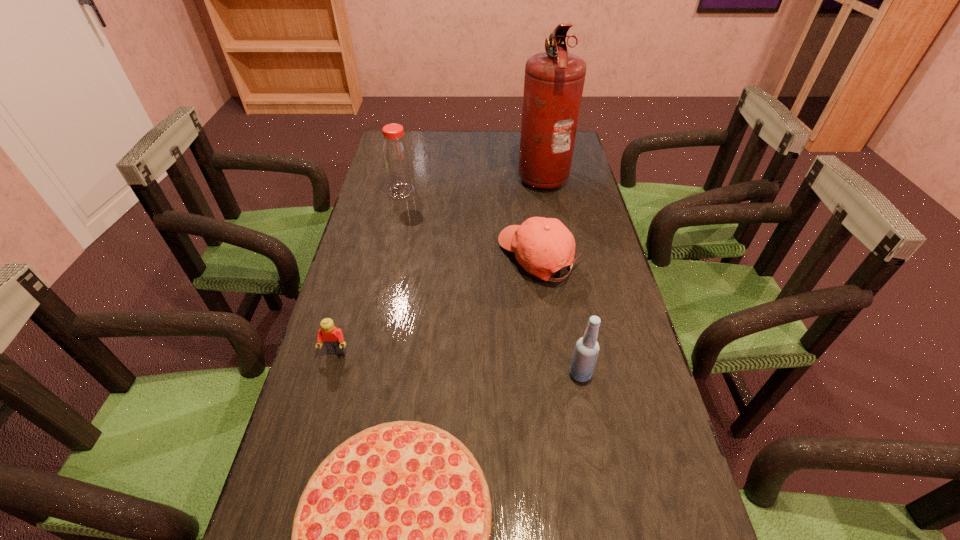
Locate an element on the screen. Image resolution: width=960 pixels, height=540 pixels. the tallest object is located at coordinates (554, 80).

I want to click on the farther bottle, so click(x=397, y=162).

Find the location of a particular element. the left bottle is located at coordinates (397, 162).

Identify the location of the third tallest object. This screenshot has width=960, height=540. (584, 358).

The height and width of the screenshot is (540, 960). In order to click on the nearer bottle in this screenshot , I will do `click(584, 358)`.

You are a GUI agent. You are given a task and a screenshot of the screen. Output one action in this format:
    pyautogui.click(x=<x>, y=<y>)
    Task: Click on the fourth nearest object
    This screenshot has width=960, height=540.
    Given the screenshot: What is the action you would take?
    pyautogui.click(x=542, y=246)

Locate an element on the screen. This screenshot has width=960, height=540. baseball cap is located at coordinates (542, 246).

The width and height of the screenshot is (960, 540). Identify the location of the second shortest object. (333, 339).

This screenshot has width=960, height=540. Find the location of `Lego`. Lego is located at coordinates (333, 339).

This screenshot has width=960, height=540. I want to click on vacant space located at the front of the tallest object where the nozzle is aimed, so click(423, 175).